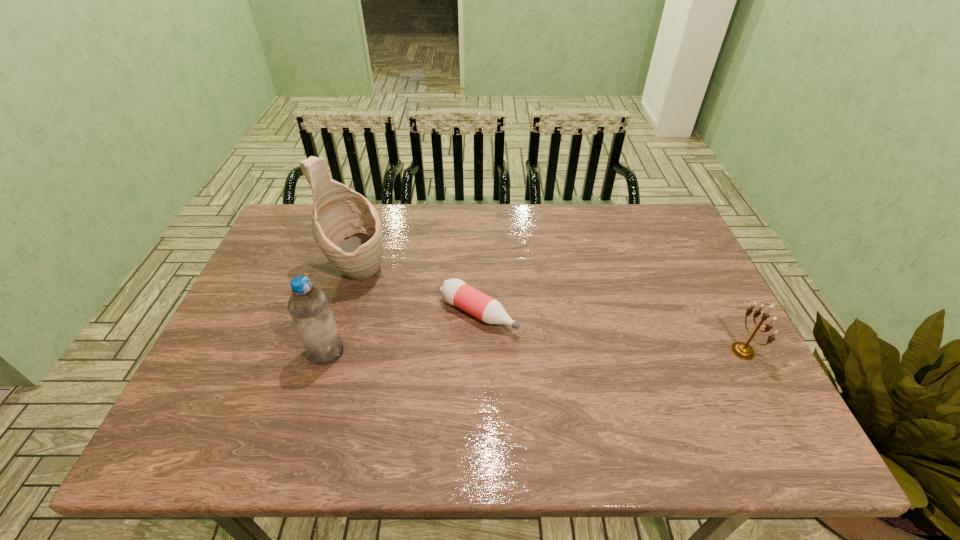
Locate an element on the screen. This screenshot has height=540, width=960. vacant area situated at the spout of the pitcher is located at coordinates (480, 350).

Where is `vacant space situated with the cap open on the shortest object`? vacant space situated with the cap open on the shortest object is located at coordinates (624, 391).

Identify the location of free region located with the cap open on the shortest object. (612, 384).

I want to click on free spot located with the cap open on the shortest object, so click(577, 364).

Where is `object located in the right edge section of the desktop`? object located in the right edge section of the desktop is located at coordinates (744, 351).

This screenshot has width=960, height=540. In the image, there is a desktop. Find the location of `vacant area at the far edge`. vacant area at the far edge is located at coordinates (425, 246).

I want to click on free spot at the near edge of the desktop, so click(277, 390).

Image resolution: width=960 pixels, height=540 pixels. What are the coordinates of `free space at the left edge of the desktop` in the screenshot? It's located at (256, 283).

Locate an element on the screen. The width and height of the screenshot is (960, 540). vacant space at the right edge of the desktop is located at coordinates (711, 299).

This screenshot has height=540, width=960. In order to click on vacant space at the near left corner in this screenshot , I will do `click(233, 394)`.